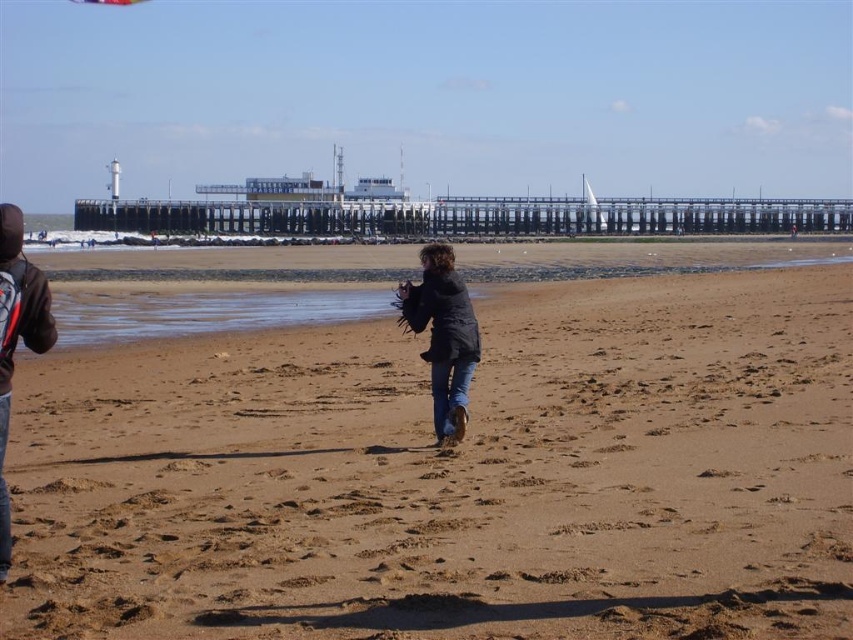
You are a photographer trying to capture the entire scene of the brown sandy beach at center and the dark gray jacket at center in one shot. Based on their widths, which object would require you to zoom out more to include its full view?

The brown sandy beach at center requires zooming out more because its width surpasses that of the dark gray jacket at center, meaning it occupies a larger portion of the frame.

You are standing at the coordinates given in the Objects Description for the brown sandy beach at center. What is the color of the sand here?

The sand at the coordinates provided for the brown sandy beach at center is brown.

You are a photographer standing at the beach and want to take a photo of the dark gray jacket at center and the dark blue hoodie at left. Do you need to adjust your camera angle to ensure both are in the frame?

The dark gray jacket at center is positioned over the dark blue hoodie at left, so you may need to adjust your camera angle to ensure both are fully visible in the frame.